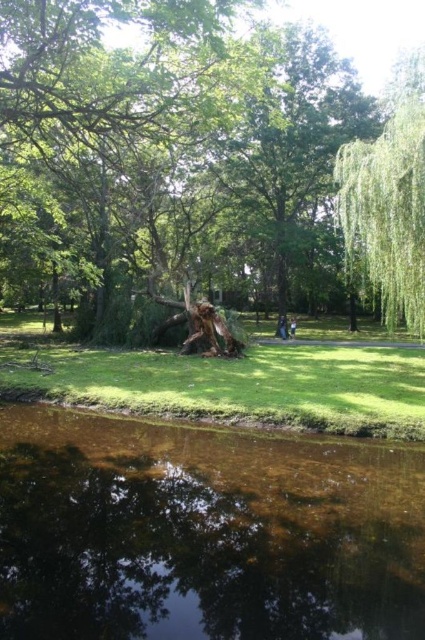
Is rough bark tree stump at center further to the viewer compared to clear water at lower center?

Yes, it is.

In the scene shown: Can you confirm if rough bark tree stump at center is positioned below clear water at lower center?

No, rough bark tree stump at center is not below clear water at lower center.

Is point (152, 8) positioned behind point (31, 636)?

That is True.

Locate an element on the screen. rough bark tree stump at center is located at coordinates (172, 156).

Can you confirm if dark blue fabric at center is positioned to the left of light brown wooden bench at center?

Indeed, dark blue fabric at center is positioned on the left side of light brown wooden bench at center.

The height and width of the screenshot is (640, 425). Describe the element at coordinates (282, 326) in the screenshot. I see `dark blue fabric at center` at that location.

Where is `dark blue fabric at center`? dark blue fabric at center is located at coordinates (282, 326).

Can you confirm if rough bark tree stump at center is shorter than light brown wooden bench at center?

No.

Describe the element at coordinates (172, 156) in the screenshot. I see `rough bark tree stump at center` at that location.

Does point (178, 172) come in front of point (294, 337)?

No, (178, 172) is behind (294, 337).

This screenshot has width=425, height=640. Identify the location of rough bark tree stump at center. (172, 156).